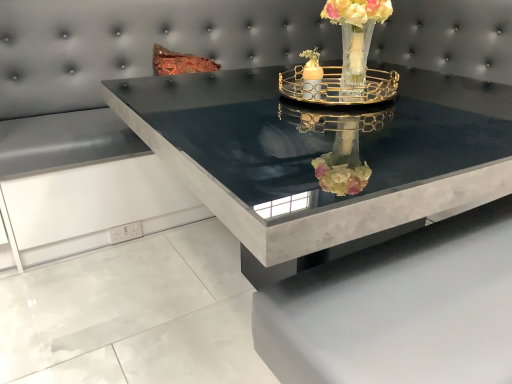
Question: Which direction should I rotate to face matte glass candle holder at center, the first candle holder from the left, — up or down?

Choices:
 (A) up
 (B) down

Answer: (A)

Question: Is black marble table at center shorter than translucent glass vase at upper center?

Choices:
 (A) no
 (B) yes

Answer: (A)

Question: Is black marble table at center positioned behind translucent glass vase at upper center?

Choices:
 (A) no
 (B) yes

Answer: (A)

Question: Does black marble table at center have a smaller size compared to translucent glass vase at upper center?

Choices:
 (A) no
 (B) yes

Answer: (A)

Question: Is black marble table at center positioned in front of translucent glass vase at upper center?

Choices:
 (A) yes
 (B) no

Answer: (A)

Question: Is black marble table at center far from translucent glass vase at upper center?

Choices:
 (A) yes
 (B) no

Answer: (B)

Question: Can you confirm if black marble table at center is positioned to the right of translucent glass vase at upper center?

Choices:
 (A) yes
 (B) no

Answer: (A)

Question: Is gold metallic tray at center, the second candle holder positioned from the left, positioned with its back to matte glass candle holder at center, the second candle holder in the right-to-left sequence?

Choices:
 (A) no
 (B) yes

Answer: (A)

Question: Is gold metallic tray at center, marked as the 1th candle holder in a right-to-left arrangement, at the right side of matte glass candle holder at center, the first candle holder from the left?

Choices:
 (A) yes
 (B) no

Answer: (A)

Question: Does gold metallic tray at center, the second candle holder positioned from the left, have a lesser height compared to matte glass candle holder at center, the first candle holder from the left?

Choices:
 (A) no
 (B) yes

Answer: (B)

Question: Would you say gold metallic tray at center, the second candle holder positioned from the left, is a long distance from matte glass candle holder at center, the second candle holder in the right-to-left sequence?

Choices:
 (A) yes
 (B) no

Answer: (B)

Question: Can you confirm if gold metallic tray at center, marked as the 1th candle holder in a right-to-left arrangement, is thinner than matte glass candle holder at center, the second candle holder in the right-to-left sequence?

Choices:
 (A) no
 (B) yes

Answer: (A)

Question: From the image's perspective, does gold metallic tray at center, marked as the 1th candle holder in a right-to-left arrangement, appear lower than matte glass candle holder at center, the second candle holder in the right-to-left sequence?

Choices:
 (A) no
 (B) yes

Answer: (B)

Question: Considering the relative positions of matte glass candle holder at center, the second candle holder in the right-to-left sequence, and black marble table at center in the image provided, is matte glass candle holder at center, the second candle holder in the right-to-left sequence, to the left of black marble table at center from the viewer's perspective?

Choices:
 (A) yes
 (B) no

Answer: (A)